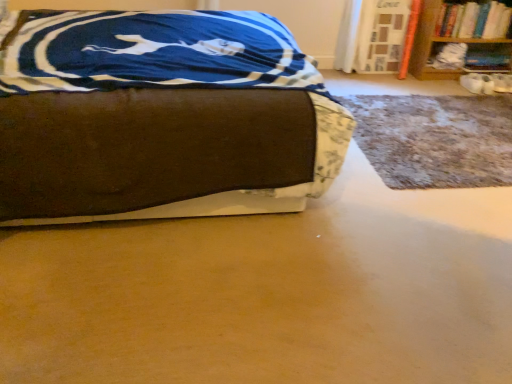
Question: Is hardcover book at upper right oriented towards brown fabric bed at center?

Choices:
 (A) yes
 (B) no

Answer: (B)

Question: Would you say hardcover book at upper right is outside brown fabric bed at center?

Choices:
 (A) yes
 (B) no

Answer: (A)

Question: Is hardcover book at upper right bigger than brown fabric bed at center?

Choices:
 (A) yes
 (B) no

Answer: (B)

Question: Is the depth of hardcover book at upper right less than that of brown fabric bed at center?

Choices:
 (A) yes
 (B) no

Answer: (B)

Question: Is hardcover book at upper right to the right of brown fabric bed at center from the viewer's perspective?

Choices:
 (A) no
 (B) yes

Answer: (B)

Question: Based on their positions, is wooden bookshelf at upper right located to the left or right of brown fabric bed at center?

Choices:
 (A) right
 (B) left

Answer: (A)

Question: Does point (510, 16) appear closer or farther from the camera than point (111, 23)?

Choices:
 (A) closer
 (B) farther

Answer: (B)

Question: In terms of width, does wooden bookshelf at upper right look wider or thinner when compared to brown fabric bed at center?

Choices:
 (A) thin
 (B) wide

Answer: (A)

Question: Is wooden bookshelf at upper right spatially inside brown fabric bed at center, or outside of it?

Choices:
 (A) outside
 (B) inside

Answer: (A)

Question: Considering the positions of wooden bookshelf at upper right and hardcover book at upper right in the image, is wooden bookshelf at upper right taller or shorter than hardcover book at upper right?

Choices:
 (A) tall
 (B) short

Answer: (A)

Question: From the image's perspective, is wooden bookshelf at upper right positioned above or below hardcover book at upper right?

Choices:
 (A) above
 (B) below

Answer: (B)

Question: In the image, is wooden bookshelf at upper right on the left side or the right side of hardcover book at upper right?

Choices:
 (A) right
 (B) left

Answer: (B)

Question: From a real-world perspective, is wooden bookshelf at upper right positioned above or below hardcover book at upper right?

Choices:
 (A) above
 (B) below

Answer: (B)

Question: In terms of width, does brown fabric bed at center look wider or thinner when compared to hardcover book at upper right?

Choices:
 (A) wide
 (B) thin

Answer: (A)

Question: Which is correct: brown fabric bed at center is inside hardcover book at upper right, or outside of it?

Choices:
 (A) outside
 (B) inside

Answer: (A)